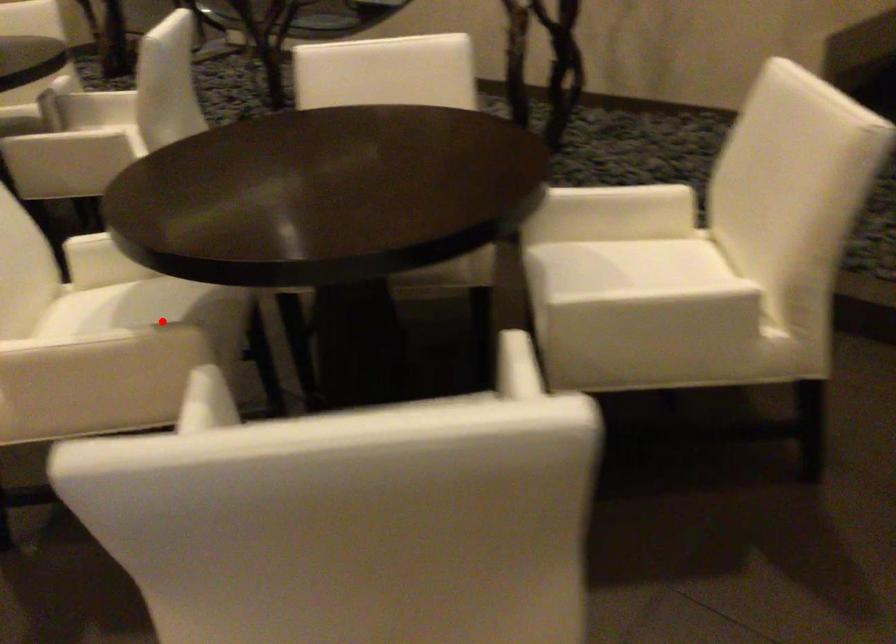
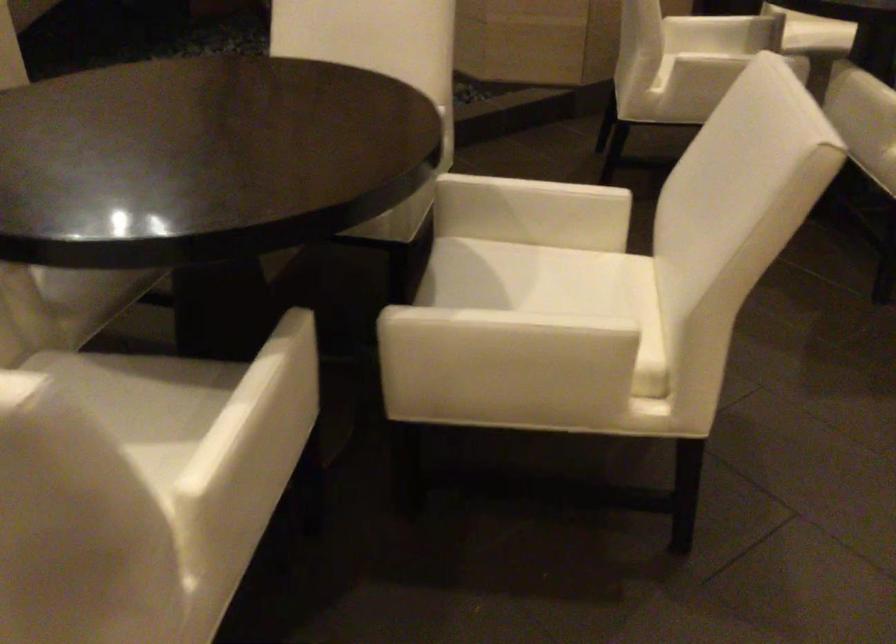
Question: I am providing you with two images of the same scene from different viewpoints. A red point is shown in image1. For the corresponding object point in image2, is it positioned nearer or farther from the camera?

Choices:
 (A) Nearer
 (B) Farther

Answer: (A)